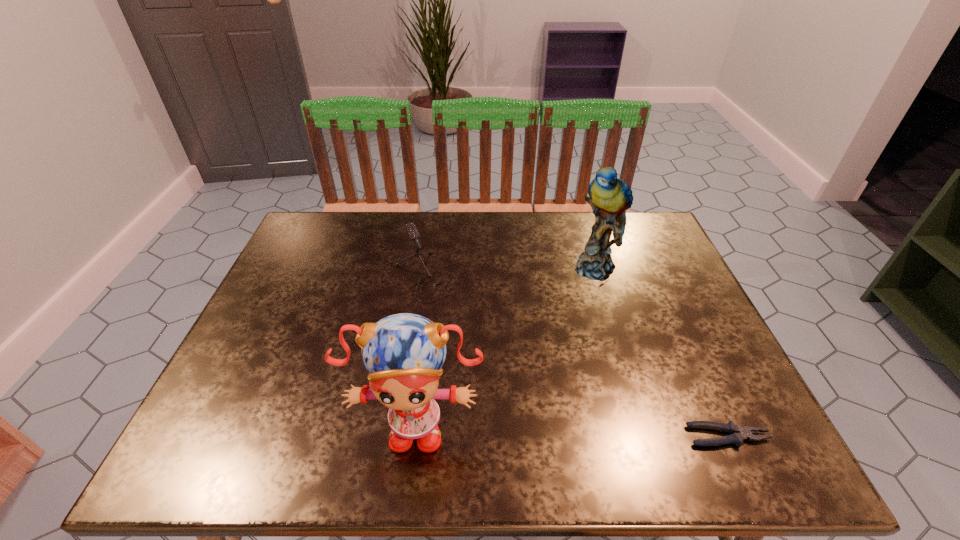
Locate an element on the screen. Image resolution: width=960 pixels, height=540 pixels. free space at the far edge of the desktop is located at coordinates coord(531,235).

Locate an element on the screen. The width and height of the screenshot is (960, 540). vacant space at the near edge of the desktop is located at coordinates (609, 402).

Image resolution: width=960 pixels, height=540 pixels. In the image, there is a desktop. Identify the location of vacant area at the left edge. (281, 272).

Image resolution: width=960 pixels, height=540 pixels. Find the location of `vacant area at the right edge of the desktop`. vacant area at the right edge of the desktop is located at coordinates (698, 385).

Where is `vacant region at the far left corner`? vacant region at the far left corner is located at coordinates (309, 219).

Find the location of `vacant space at the near right corner`. vacant space at the near right corner is located at coordinates (732, 416).

You are a GUI agent. You are given a task and a screenshot of the screen. Output one action in this format:
    pyautogui.click(x=<x>, y=<y>)
    Task: Click on the unoccupied area between the pliers and the second object from right to left
    This screenshot has width=960, height=540.
    Given the screenshot: What is the action you would take?
    (663, 352)

At what (x,y) coordinates should I click in order to perform the action: click on blank region between the rightmost object and the doll. Please return your answer as a coordinate pair (x, y). Looking at the image, I should click on (572, 429).

This screenshot has width=960, height=540. Find the location of `free spot between the parrot and the microphone`. free spot between the parrot and the microphone is located at coordinates (514, 272).

I want to click on empty location between the parrot and the doll, so click(507, 346).